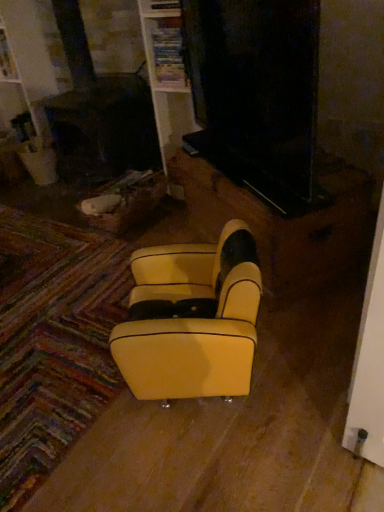
The image size is (384, 512). In order to click on vacant area that is in front of yellow leather/velvet rocking chair at center in this screenshot , I will do `click(203, 459)`.